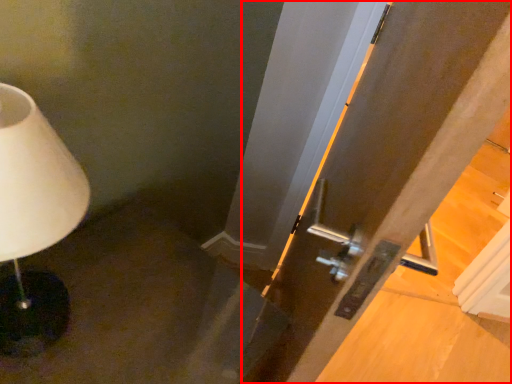
Question: Considering the relative positions of door (annotated by the red box) and lamp in the image provided, where is door (annotated by the red box) located with respect to the staircase?

Choices:
 (A) left
 (B) right

Answer: (B)